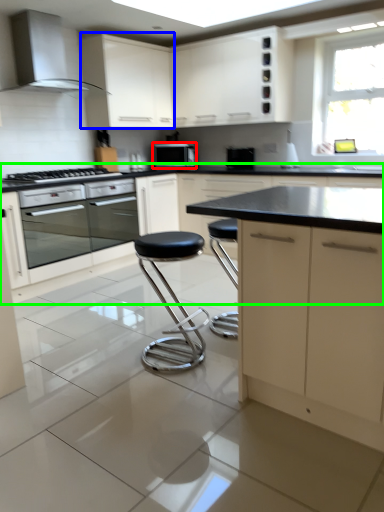
Question: Which object is the closest to the kitchen appliance (highlighted by a red box)? Choose among these: cabinetry (highlighted by a blue box) or cabinetry (highlighted by a green box).

Choices:
 (A) cabinetry
 (B) cabinetry

Answer: (A)